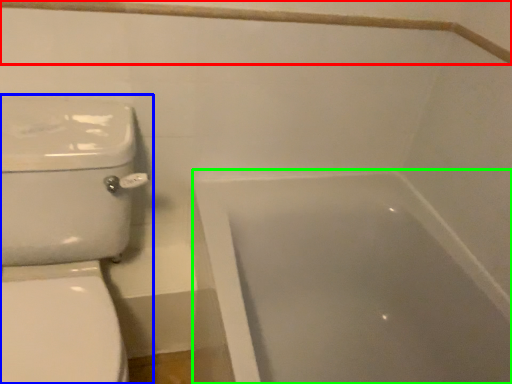
Question: Considering the real-world distances, which object is farthest from balustrade (highlighted by a red box)? toilet (highlighted by a blue box) or bathtub (highlighted by a green box)?

Choices:
 (A) toilet
 (B) bathtub

Answer: (B)